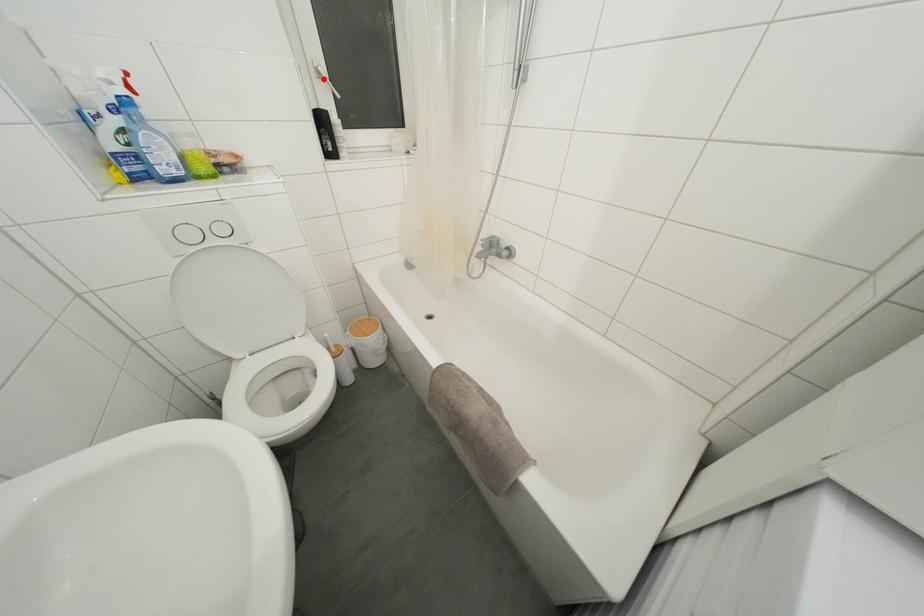
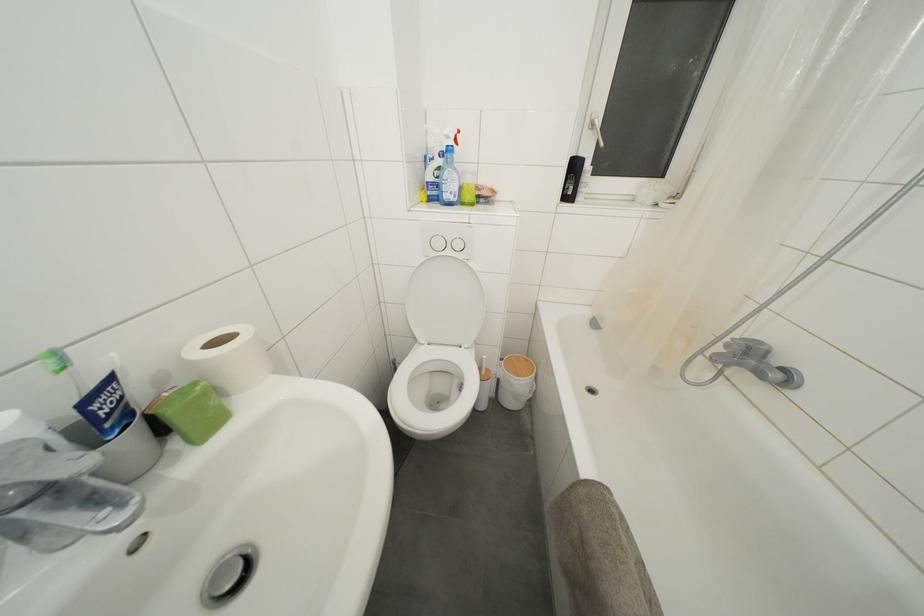
Locate, in the second image, the point that corresponds to the highlighted location in the first image.

(597, 131)